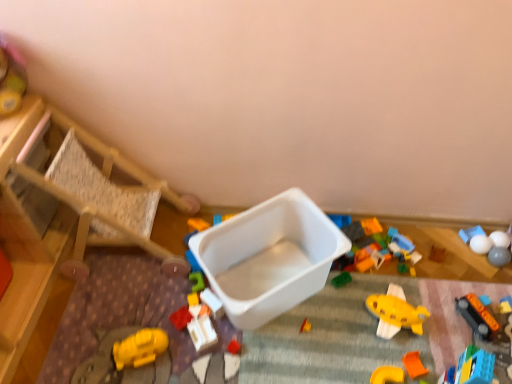
Identify the location of vacant area that lies to the right of white plastic container at center, the third toy viewed from the left. The width and height of the screenshot is (512, 384). [x=259, y=345].